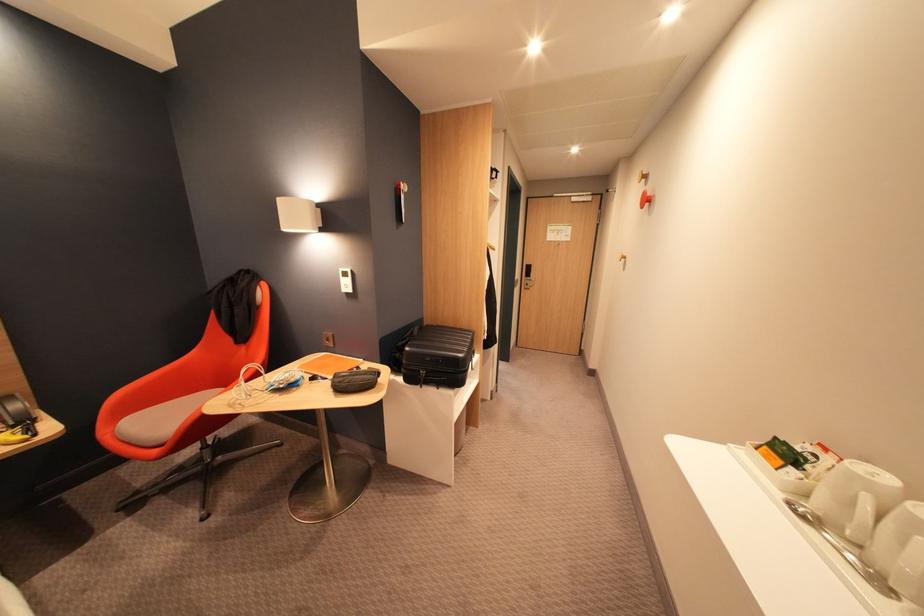
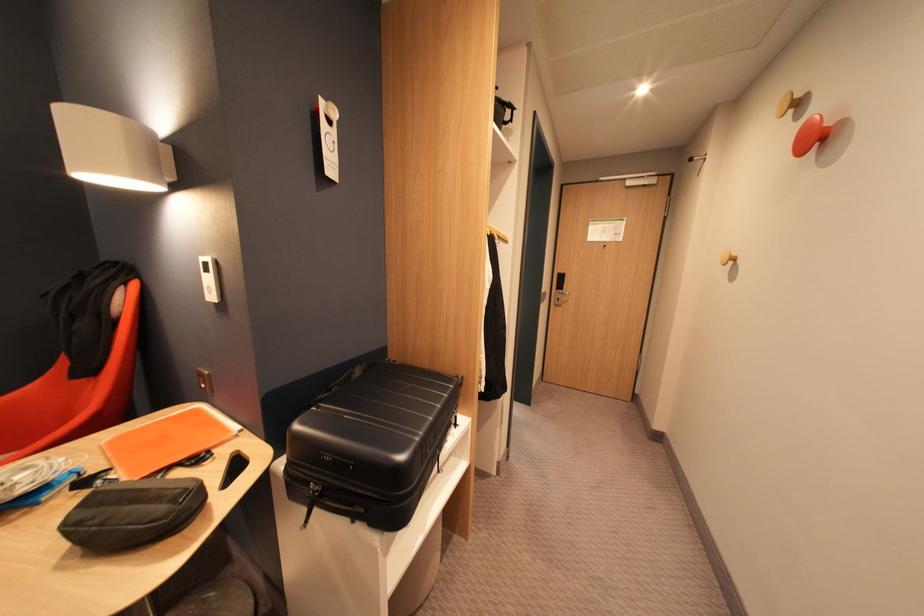
Find the pixel in the second image that matches point 358,273 in the first image.

(216, 265)